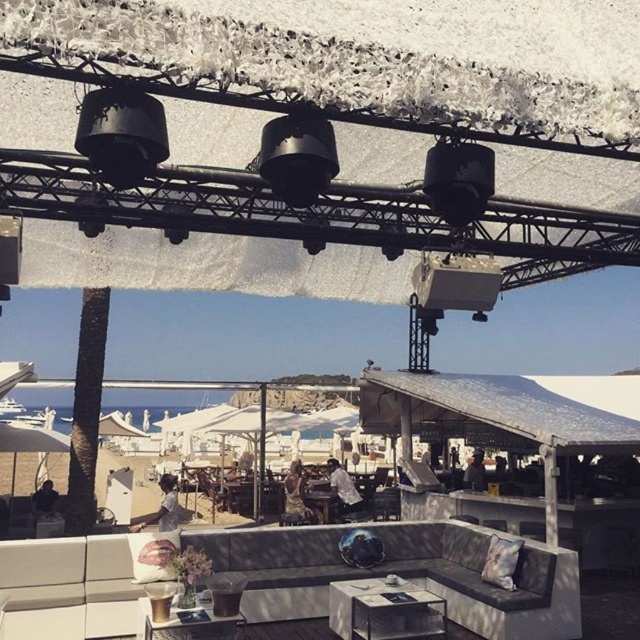
Is leather couch at center below matte white table at center?

No.

Describe the element at coordinates (403, 573) in the screenshot. I see `leather couch at center` at that location.

What do you see at coordinates (403, 573) in the screenshot? The width and height of the screenshot is (640, 640). I see `leather couch at center` at bounding box center [403, 573].

You are a GUI agent. You are given a task and a screenshot of the screen. Output one action in this format:
    pyautogui.click(x=<x>, y=<y>)
    Task: Click on the leather couch at center
    The height and width of the screenshot is (640, 640).
    Given the screenshot: What is the action you would take?
    pyautogui.click(x=403, y=573)

Is leather couch at center below wooden table at lower center?

Yes.

Does leather couch at center come in front of wooden table at lower center?

No, leather couch at center is behind wooden table at lower center.

Which is in front, point (19, 612) or point (205, 620)?

Point (205, 620) is in front.

I want to click on leather couch at center, so click(x=403, y=573).

Which is below, leather couch at center or wooden chair at center?

Positioned lower is wooden chair at center.

Who is shorter, leather couch at center or wooden chair at center?

With less height is wooden chair at center.

Between point (282, 541) and point (196, 477), which one is positioned behind?

Point (196, 477)

This screenshot has height=640, width=640. What are the coordinates of `leather couch at center` in the screenshot? It's located at (403, 573).